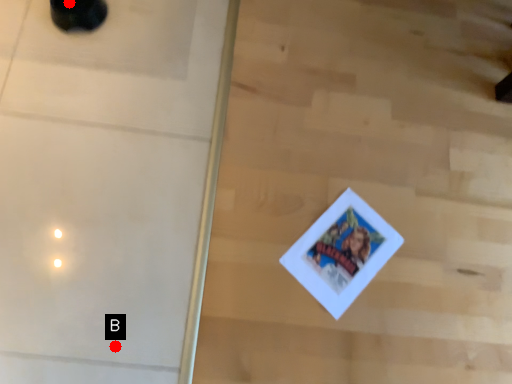
Question: Two points are circled on the image, labeled by A and B beside each circle. Which point appears closest to the camera in this image?

Choices:
 (A) A is closer
 (B) B is closer

Answer: (B)